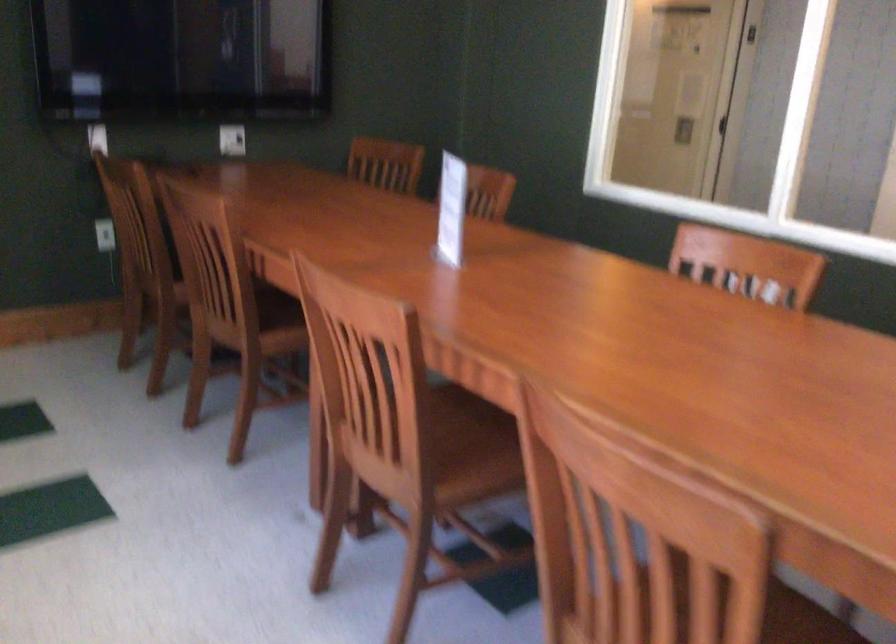
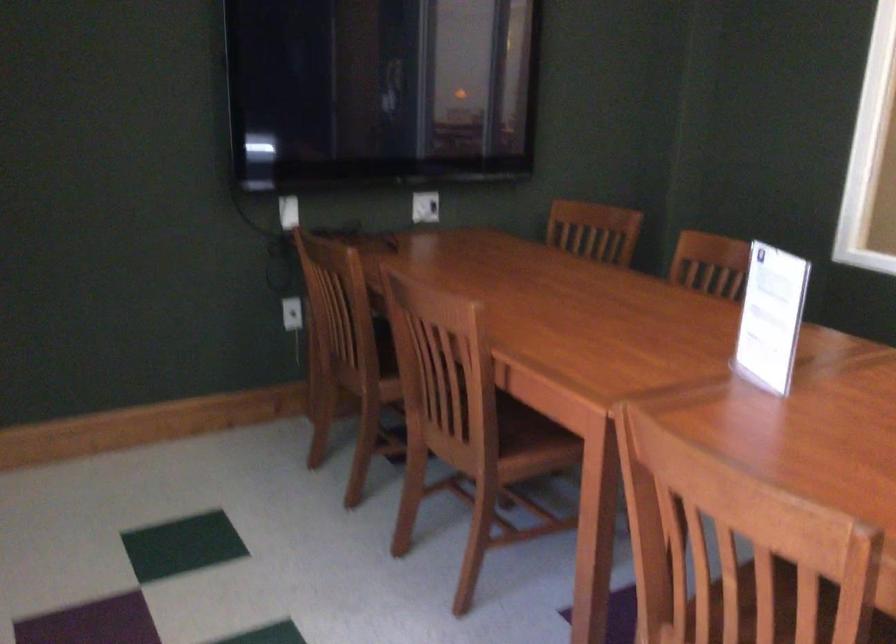
Question: Based on the continuous images, in which direction is the camera rotating? Reply with the corresponding letter.

Choices:
 (A) Left
 (B) Right
 (C) Up
 (D) Down

Answer: (A)